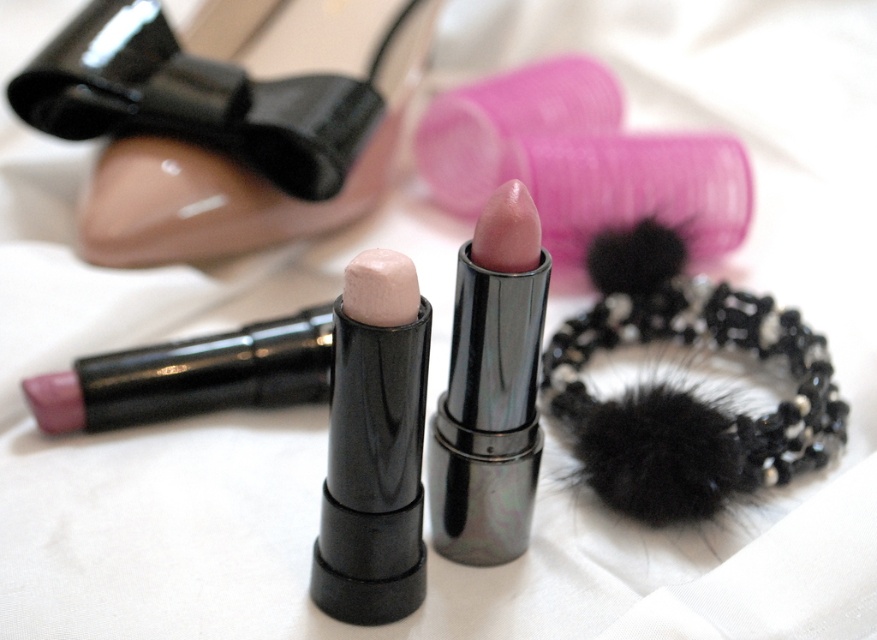
You are organizing a makeup kit and have two lipsticks in front of you. You need to place the shiny metallic lipstick at center and the matte pink lipstick at center into a compartment that can only fit the smaller of the two. Which lipstick should you choose?

You should choose the matte pink lipstick at center because it is smaller than the shiny metallic lipstick at center, so it will fit in the compartment designed for the smaller one.

You are organizing a beauty kit and need to place the glossy plastic shoe at upper left and pearlized matte highlighter at center into a drawer. Based on their positions in the image, which one should you place first to maintain the arrangement?

The glossy plastic shoe at upper left should be placed first since it is positioned above the pearlized matte highlighter at center, indicating it should be placed higher in the drawer.

You are a beauty blogger who wants to place a 12 inch ruler between the pearlized matte highlighter at center and the matte pink lipstick at center. Will the ruler fit exactly between them without overlapping either item?

The pearlized matte matte highlighter at center and matte pink lipstick at center are 14.39 inches apart. Since the ruler is only 12 inches long, it won